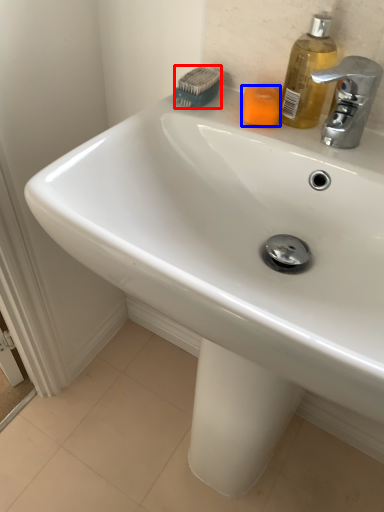
Question: Which point is further to the camera, brush (highlighted by a red box) or soap (highlighted by a blue box)?

Choices:
 (A) brush
 (B) soap

Answer: (A)